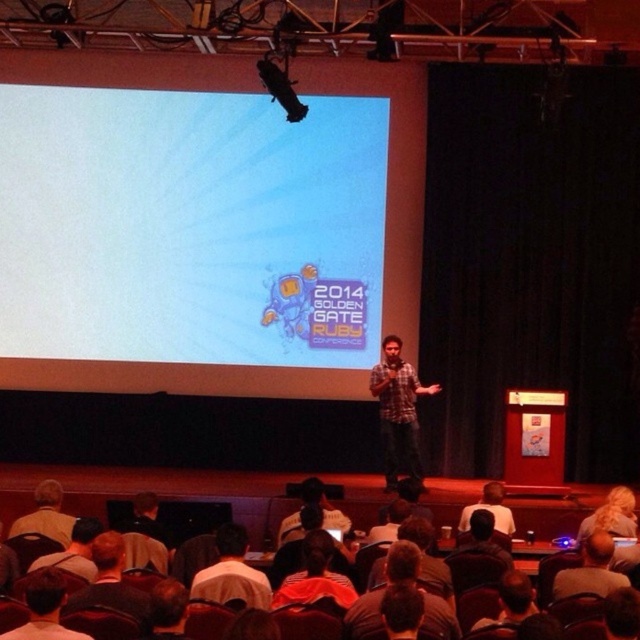
Question: Can you confirm if white matte projection screen at upper center is smaller than plaid fabric shirt at center?

Choices:
 (A) no
 (B) yes

Answer: (B)

Question: Based on their relative distances, which object is farther from the dark brown leather jacket at lower left?

Choices:
 (A) matte black shirt at center
 (B) plaid fabric shirt at center

Answer: (B)

Question: Does white matte projection screen at upper center appear over matte black shirt at center?

Choices:
 (A) no
 (B) yes

Answer: (B)

Question: Is white matte projection screen at upper center thinner than dark brown leather jacket at lower left?

Choices:
 (A) yes
 (B) no

Answer: (B)

Question: Which of the following is the farthest from the observer?

Choices:
 (A) white shirt at lower center
 (B) dark brown leather jacket at lower left
 (C) plaid fabric shirt at center

Answer: (C)

Question: Which point is farther to the camera?

Choices:
 (A) (387, 488)
 (B) (234, 593)

Answer: (A)